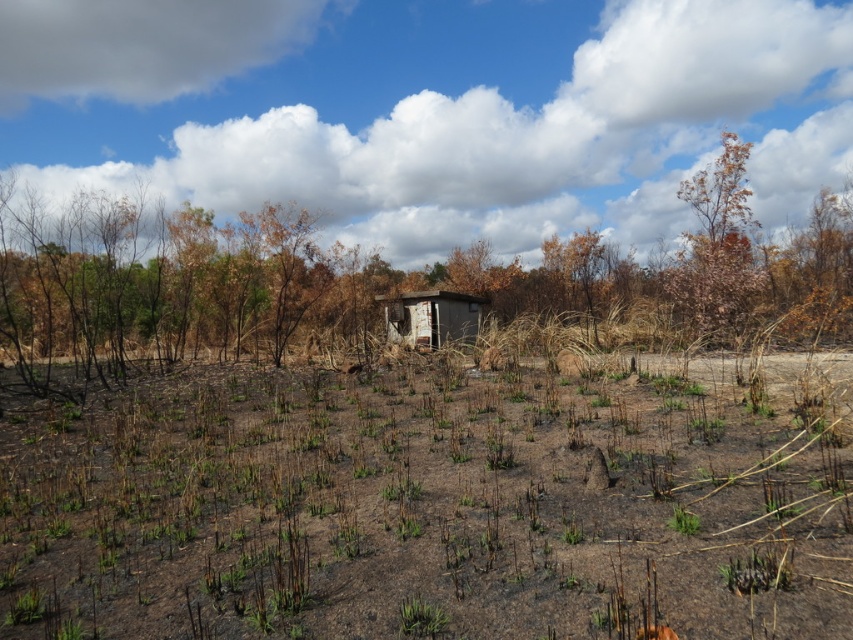
You are a firefighter assessing the damage after a wildfire. You notice the brown dry wood at upper right and the weathered wood hut at center. Which object is larger in size?

The brown dry wood at upper right is bigger than the weathered wood hut at center according to the description.

You are a firefighter assessing the post fire area. You see the brown dry wood at center. Where exactly is it located in the image?

The brown dry wood at center is located at point (383, 276) in the image.

You are a drone operator tasked with assessing the fire damage. Your drone is currently at the point marked by point (x=434, y=109). You need to fly it to the nearest point where you can see both the small green shoots of new growth and the dilapidated structure. Is this possible?

The point marked by point (x=434, y=109) is located at the white fluffy cloud at upper center. Since the small green shoots of new growth are in the foreground and the dilapidated structure is in the middle ground, the drone can descend from the cloud point to a lower elevation where both elements are visible simultaneously.